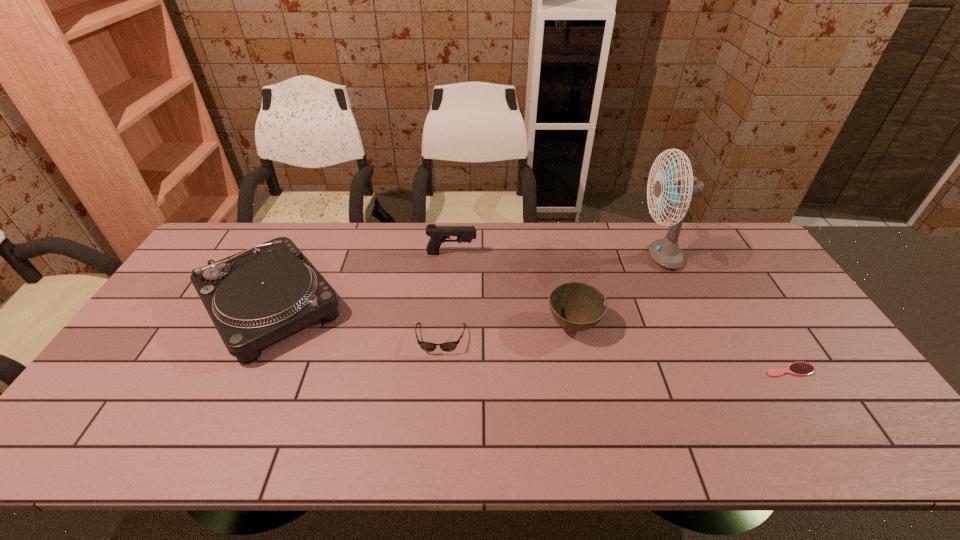
You are a GUI agent. You are given a task and a screenshot of the screen. Output one action in this format:
    pyautogui.click(x=<x>, y=<y>)
    Task: Click on the tallest object
    
    Given the screenshot: What is the action you would take?
    pyautogui.click(x=666, y=252)

This screenshot has width=960, height=540. Identify the location of fan. coord(666,252).

What are the coordinates of `the leftmost object` in the screenshot? It's located at (254, 298).

Locate an element on the screen. pistol is located at coordinates (438, 234).

The height and width of the screenshot is (540, 960). I want to click on the third object from right to left, so click(576, 306).

Where is `sunglasses`? The height and width of the screenshot is (540, 960). sunglasses is located at coordinates (426, 346).

Locate an element on the screen. This screenshot has width=960, height=540. the rightmost object is located at coordinates (797, 368).

Identify the location of hairbrush. (797, 368).

In order to click on free region located on the front-facing side of the second object from right to left in this screenshot , I will do `click(551, 256)`.

The image size is (960, 540). I want to click on vacant space situated 0.390m on the front-facing side of the second object from right to left, so click(521, 256).